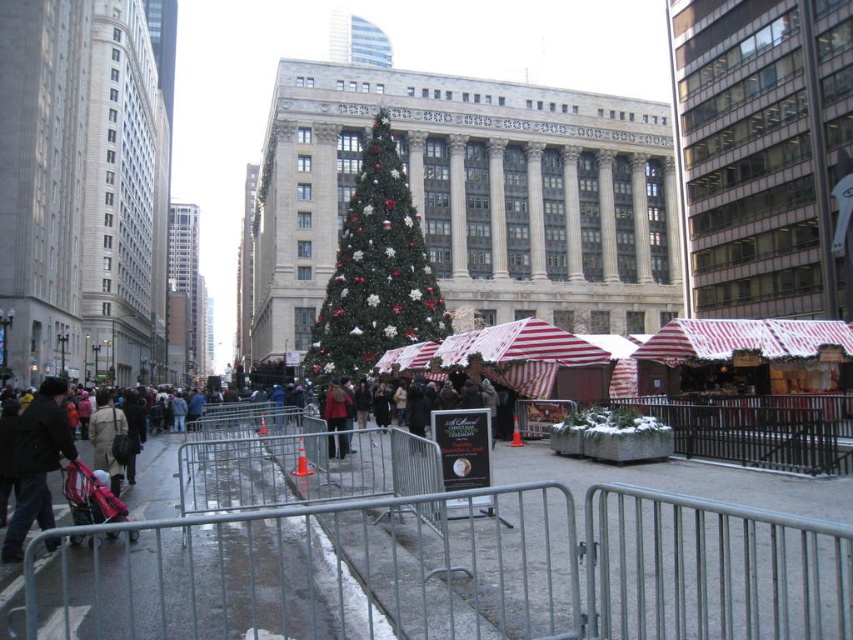
Can you confirm if green matte christmas tree at center is smaller than red wool coat at center?

Incorrect, green matte christmas tree at center is not smaller in size than red wool coat at center.

Is green matte christmas tree at center bigger than red wool coat at center?

Yes.

Is point (352, 188) closer to camera compared to point (331, 410)?

That is False.

Where is `green matte christmas tree at center`? This screenshot has width=853, height=640. green matte christmas tree at center is located at coordinates (376, 269).

Which is more to the right, green matte christmas tree at center or dark gray jacket at lower left?

Positioned to the right is green matte christmas tree at center.

Does green matte christmas tree at center have a larger size compared to dark gray jacket at lower left?

Yes, green matte christmas tree at center is bigger than dark gray jacket at lower left.

Is point (320, 330) farther from viewer compared to point (48, 385)?

Yes, it is.

This screenshot has height=640, width=853. What are the coordinates of `green matte christmas tree at center` in the screenshot? It's located at (376, 269).

Measure the distance between dark gray jacket at lower left and red wool coat at center.

51.19 feet

Is point (12, 556) positioned before point (344, 417)?

Yes, point (12, 556) is in front of point (344, 417).

Find the location of `dark gray jacket at lower left`. dark gray jacket at lower left is located at coordinates (38, 464).